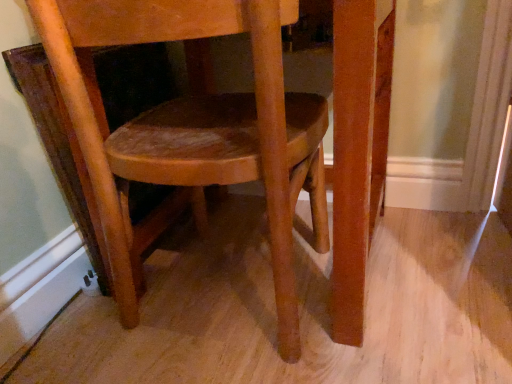
Describe the element at coordinates (195, 130) in the screenshot. I see `wooden chair at center` at that location.

This screenshot has width=512, height=384. I want to click on wooden chair at center, so click(195, 130).

Measure the distance between wooden chair at center and camera.

wooden chair at center is 41.60 centimeters away from camera.

Find the location of a particular element. The image size is (512, 384). wooden chair at center is located at coordinates (195, 130).